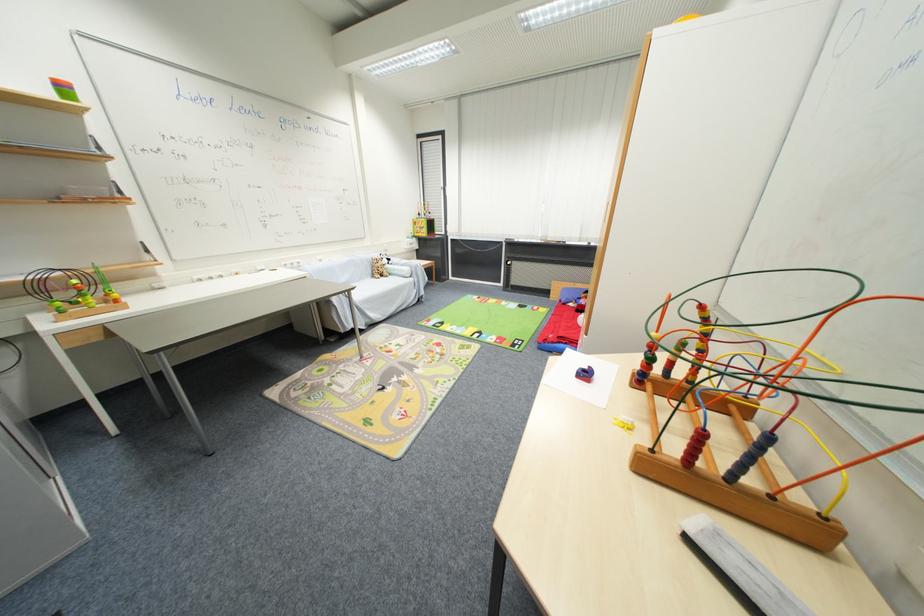
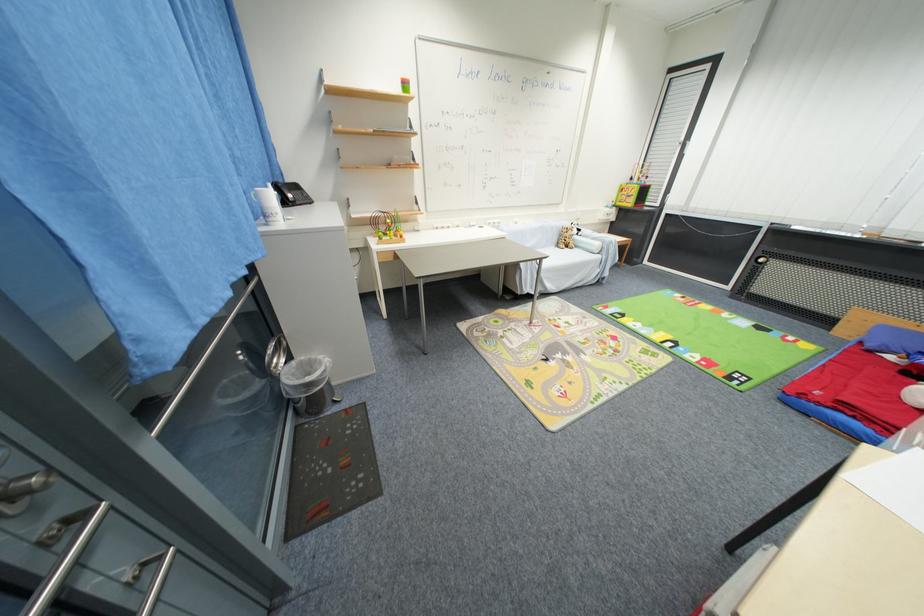
Where in the second image is the point corresponding to (x=417, y=282) from the first image?

(603, 259)